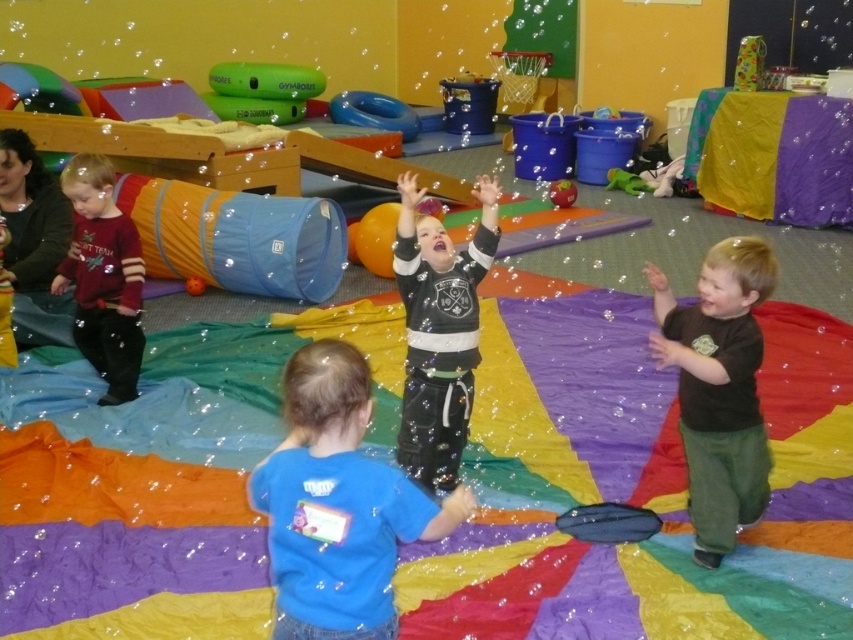
Can you confirm if green rubber ball at upper center is smaller than rubber ball at center?

No.

Which is more to the right, green rubber ball at upper center or rubber ball at center?

rubber ball at center

Is point (315, 84) farther from camera compared to point (553, 202)?

Yes, point (315, 84) is farther from viewer.

Locate an element on the screen. green rubber ball at upper center is located at coordinates [x=265, y=81].

Who is positioned more to the right, brown cotton shirt at right or green fabric at center?

From the viewer's perspective, green fabric at center appears more on the right side.

Identify the location of brown cotton shirt at right. Image resolution: width=853 pixels, height=640 pixels. (718, 388).

Consider the image. Does brown cotton shirt at right have a larger size compared to rubber ball at center?

Yes, brown cotton shirt at right is bigger than rubber ball at center.

This screenshot has height=640, width=853. What do you see at coordinates (718, 388) in the screenshot?
I see `brown cotton shirt at right` at bounding box center [718, 388].

Where is `brown cotton shirt at right`? brown cotton shirt at right is located at coordinates (718, 388).